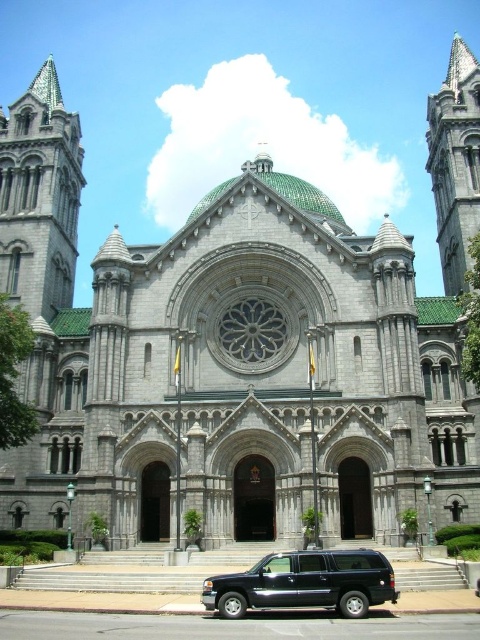
You are a visitor standing in front of the cathedral. You see the gray stone tower at upper right and the black matte suv at lower center. Which object is positioned higher from the ground?

The gray stone tower at upper right is located above the black matte suv at lower center, so it is positioned higher from the ground.

You are standing in front of the cathedral and want to reach the point marked at coordinates point (463, 243). If your maximum walking distance is 70 meters, will you be able to reach it without exceeding your limit?

The point (463, 243) is 73.25 meters away from the camera, which exceeds your maximum walking distance of 70 meters. Therefore, you won not be able to reach it without exceeding your limit.

You are standing in front of the cathedral and want to locate two specific points marked on the facade. The first point is at coordinates point (452, 284) and the second is at point (201, 598). Which of these two points is closer to you?

Point (452, 284) is closer to you because it is further to the viewer than point (201, 598).